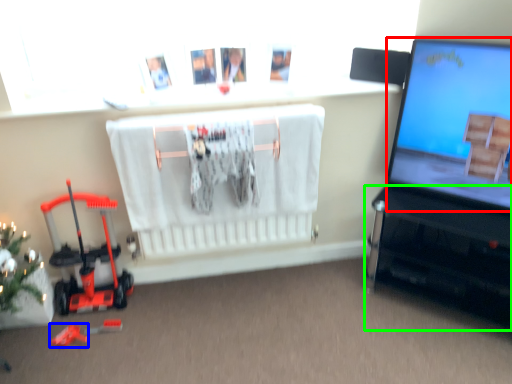
Question: Estimate the real-world distances between objects in this image. Which object is farther from computer screen (highlighted by a red box), toy (highlighted by a blue box) or furniture (highlighted by a green box)?

Choices:
 (A) toy
 (B) furniture

Answer: (A)